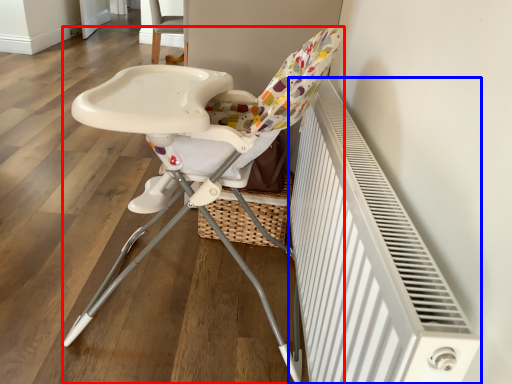
Question: Which object is closer to the camera taking this photo, chair (highlighted by a red box) or radiator (highlighted by a blue box)?

Choices:
 (A) chair
 (B) radiator

Answer: (B)